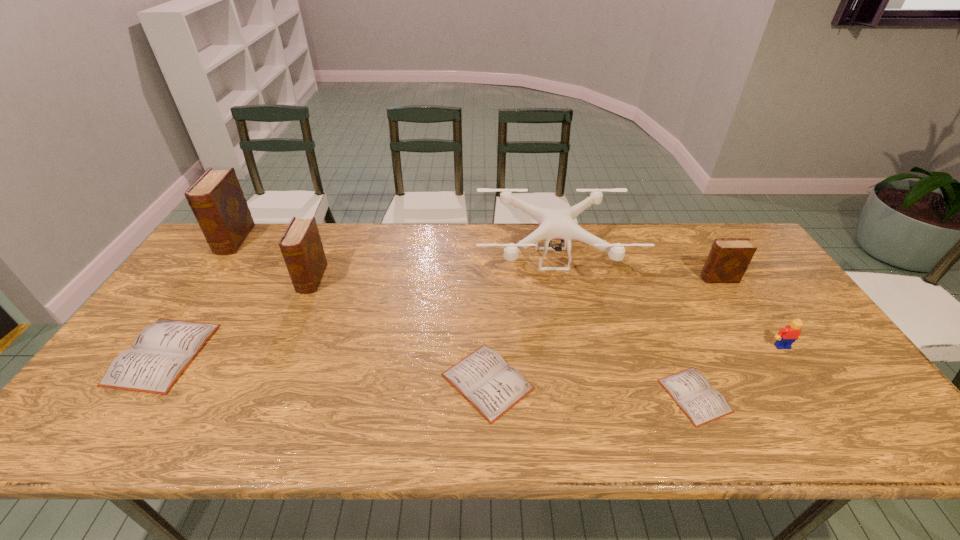
Locate which white diary is the third closest to the gray drone. Please provide its 2D coordinates. Your answer should be formatted as a tuple, i.e. [(x, y)], where the tuple contains the x and y coordinates of a point satisfying the conditions above.

[(160, 353)]

You are a GUI agent. You are given a task and a screenshot of the screen. Output one action in this format:
    pyautogui.click(x=<x>, y=<y>)
    Task: Click on the vacant space that satisfies the following two spatial constraints: 1. on the spine side of the biggest white diary; 2. on the left side of the leftmost brown diary
    
    Given the screenshot: What is the action you would take?
    pyautogui.click(x=154, y=354)

Find the location of a particular element. vacant position in the image that satisfies the following two spatial constraints: 1. on the spine side of the leftmost brown diary; 2. on the right side of the rightmost white diary is located at coordinates (124, 396).

Image resolution: width=960 pixels, height=540 pixels. I want to click on vacant point that satisfies the following two spatial constraints: 1. on the spine side of the shortest diary; 2. on the left side of the farthest diary, so click(x=124, y=396).

Identify the location of free spot that satisfies the following two spatial constraints: 1. on the spine side of the second white diary from left to right; 2. on the left side of the farthest diary. (133, 381).